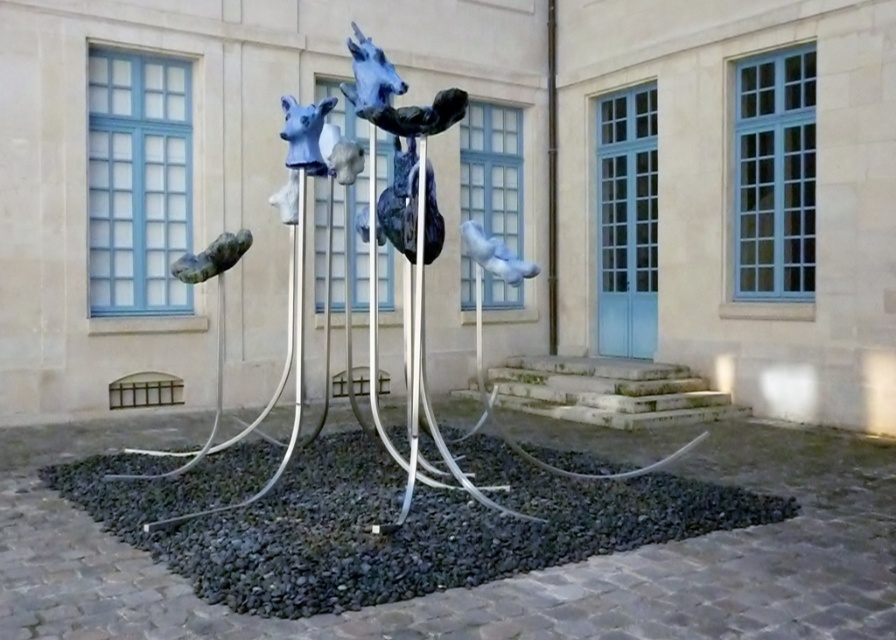
You are standing in front of the sculpture and want to take a photo of the metallic blue horse heads at center. If you move 0.1 units to the right along the x axis, will the heads still be in the center of your view?

The metallic blue horse heads at center is located at point (479,333). Moving 0.1 units to the right along the x axis would shift the position to approximately 0.622, which may move the heads out of the center of your view depending on the camera angle and field of view. However, since the original coordinates are at the center, slight movements might still keep them centered unless the shift exceeds the camera frame.

What are the coordinates of the matte blue bird at center?

The matte blue bird at center is located at coordinates point [495,256].

You are standing in front of the sculpture and want to know how far the point marked at coordinates point (481, 257) is from where you are standing. Can you determine the distance?

The point (481, 257) is 17.03 feet away from the camera, so the distance from where you are standing to the point marked at coordinates point (481, 257) is 17.03 feet.